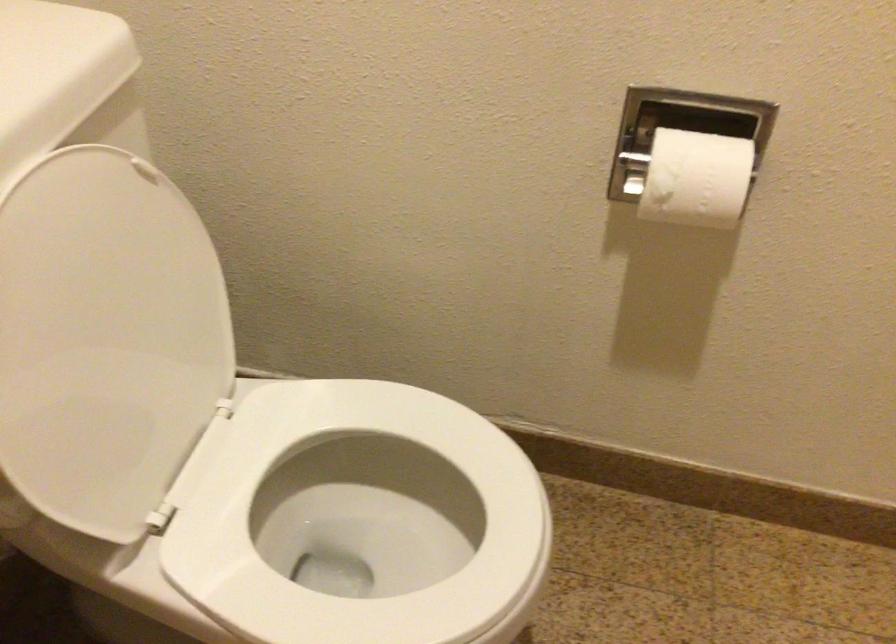
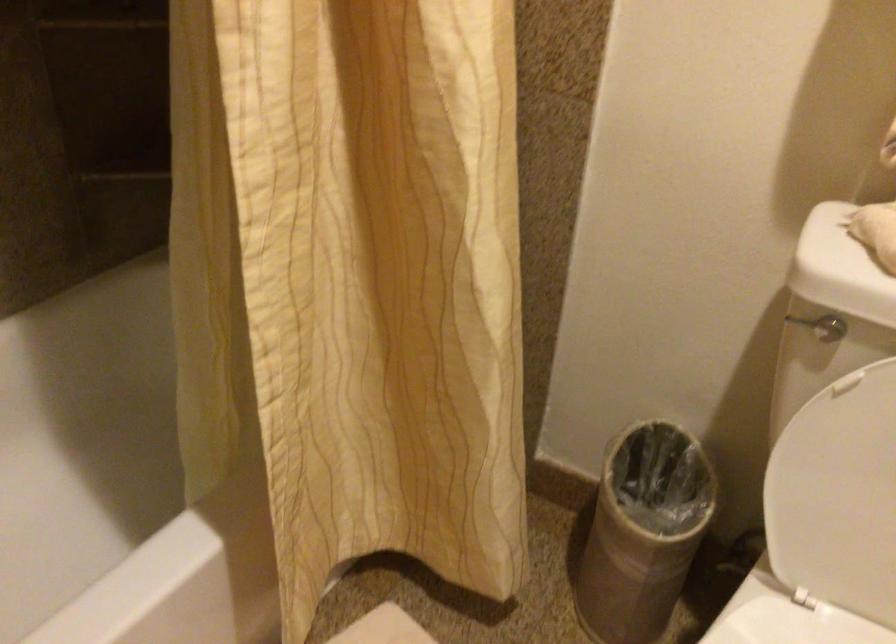
Based on the continuous images, in which direction is the camera rotating?

The rotation direction of the camera is left-down.